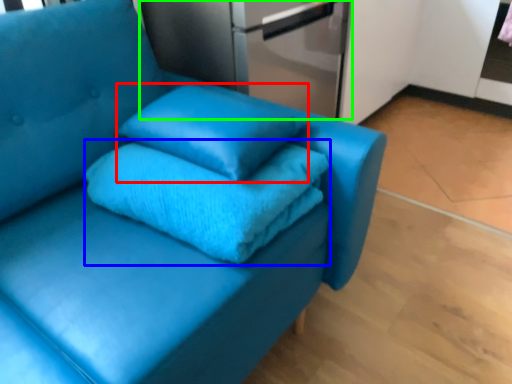
Question: Considering the real-world distances, which object is farthest from pillow (highlighted by a red box)? bath towel (highlighted by a blue box) or appliance (highlighted by a green box)?

Choices:
 (A) bath towel
 (B) appliance

Answer: (B)